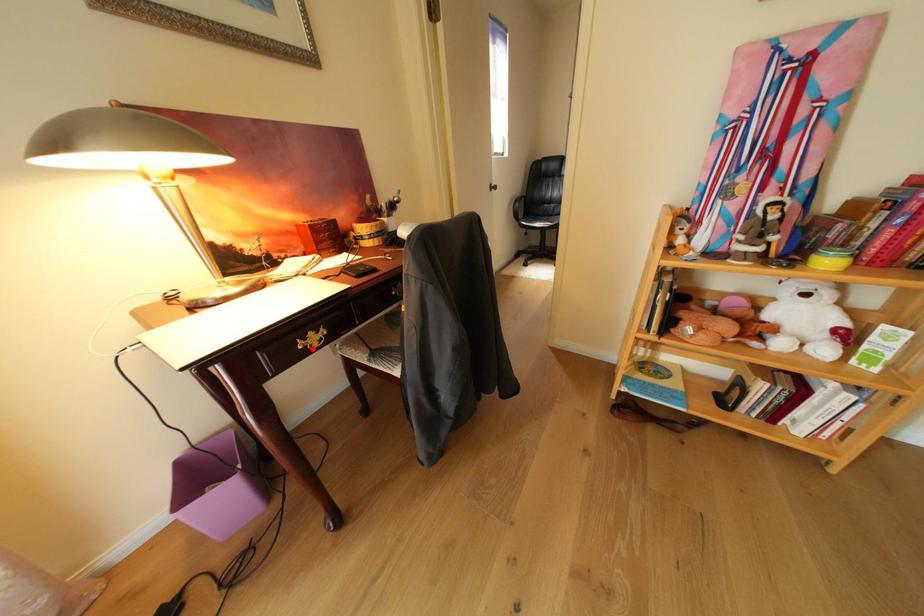
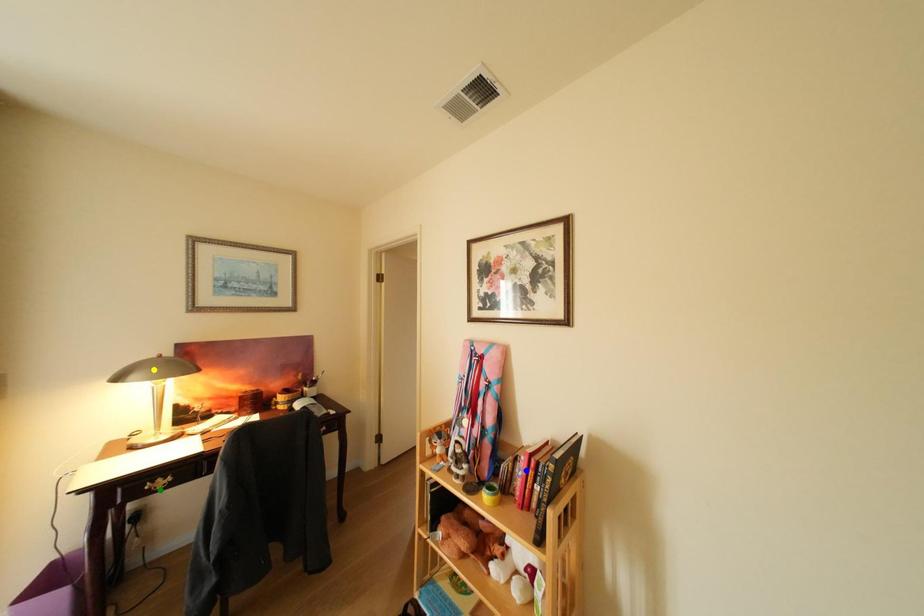
Question: I am providing you with two images of the same scene from different viewpoints. A red point is marked on the first image. You are given multiple points on the second image. In image 2, which mark is for the same physical point as the one in image 1?

Choices:
 (A) yellow point
 (B) green point
 (C) blue point

Answer: (B)